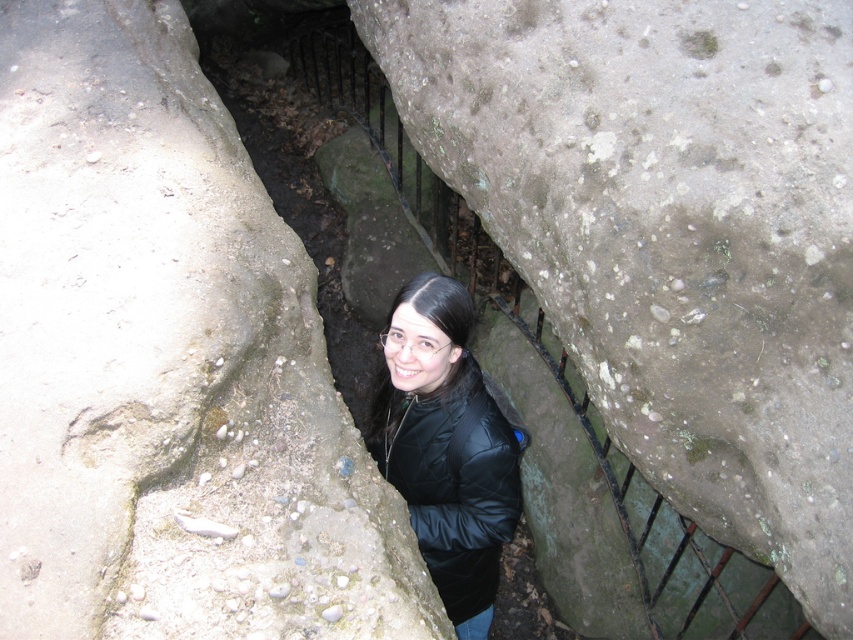
You are navigating through a narrow passage between two stone walls. You need to place a small marker at the point that is closer to you. Which point should you choose between point (671, 432) and point (480, 509)?

Point (671, 432) is closer to the viewer than point (480, 509), so you should place the marker at point (671, 432).

You are a hiker who wants to climb up the rocks in the passage. You see the rough textured rock at upper left and the rough textured rock at center. Which rock should you grab first to start your climb?

You should grab the rough textured rock at upper left first because it is shorter than the rough textured rock at center, making it easier to reach and begin climbing.

You are a hiker who wants to take a photo of the rough textured rock at center and the black quilted jacket at center. How far apart are they?

The rough textured rock at center is 25.77 inches from the black quilted jacket at center, so they are 25.77 inches apart.